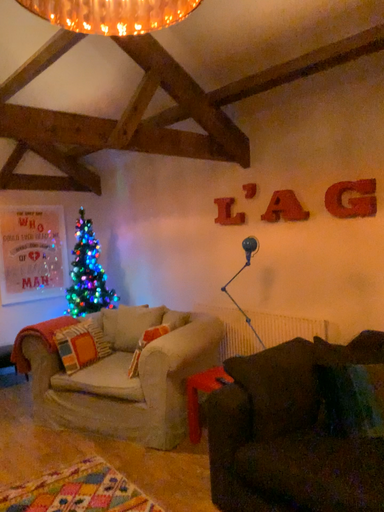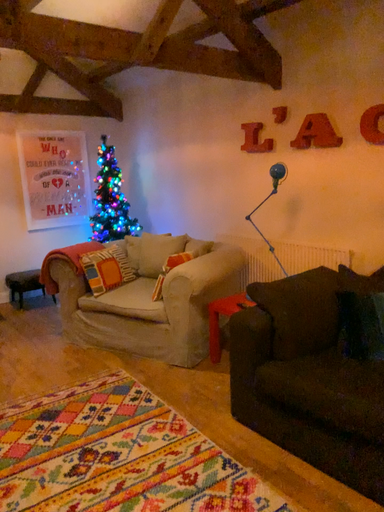
Question: Which way did the camera rotate in the video?

Choices:
 (A) rotated downward
 (B) rotated upward

Answer: (A)